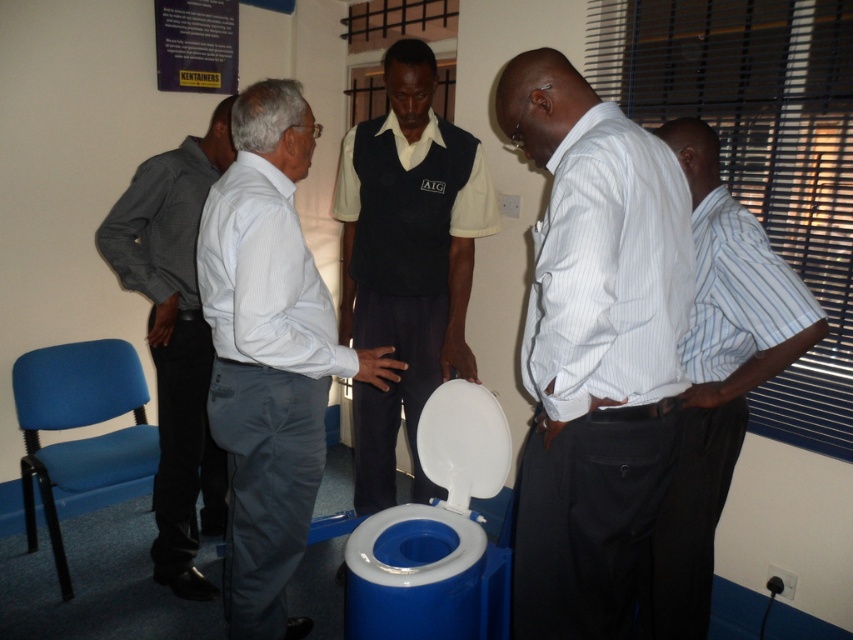
Describe the element at coordinates (718, 376) in the screenshot. The image size is (853, 640). I see `white striped shirt at right` at that location.

Is point (693, 604) closer to viewer compared to point (440, 476)?

Yes.

Is point (694, 141) more distant than point (463, 435)?

That is False.

This screenshot has width=853, height=640. I want to click on white striped shirt at right, so click(x=718, y=376).

Does point (595, 124) come closer to viewer compared to point (482, 424)?

Yes, point (595, 124) is in front of point (482, 424).

Is point (639, 461) closer to viewer compared to point (463, 470)?

Yes, point (639, 461) is in front of point (463, 470).

The height and width of the screenshot is (640, 853). What are the coordinates of `white striped shirt at center` in the screenshot? It's located at (593, 349).

Which is more to the right, white striped shirt at right or dark gray shirt at left?

Positioned to the right is white striped shirt at right.

Is white striped shirt at right to the right of dark gray shirt at left from the viewer's perspective?

Yes, white striped shirt at right is to the right of dark gray shirt at left.

Is point (751, 376) closer to viewer compared to point (204, 177)?

Yes.

I want to click on white striped shirt at right, so coord(718,376).